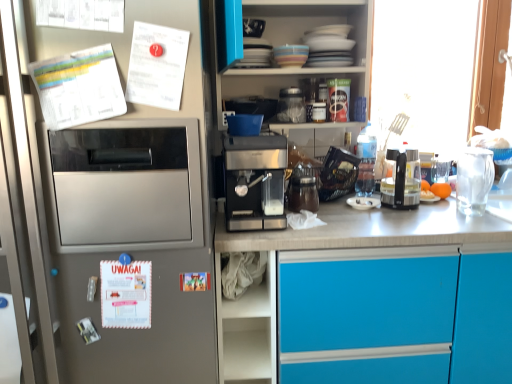
Locate an element on the screen. This screenshot has width=512, height=384. free space on the front side of black plastic coffee machine at center is located at coordinates (418, 220).